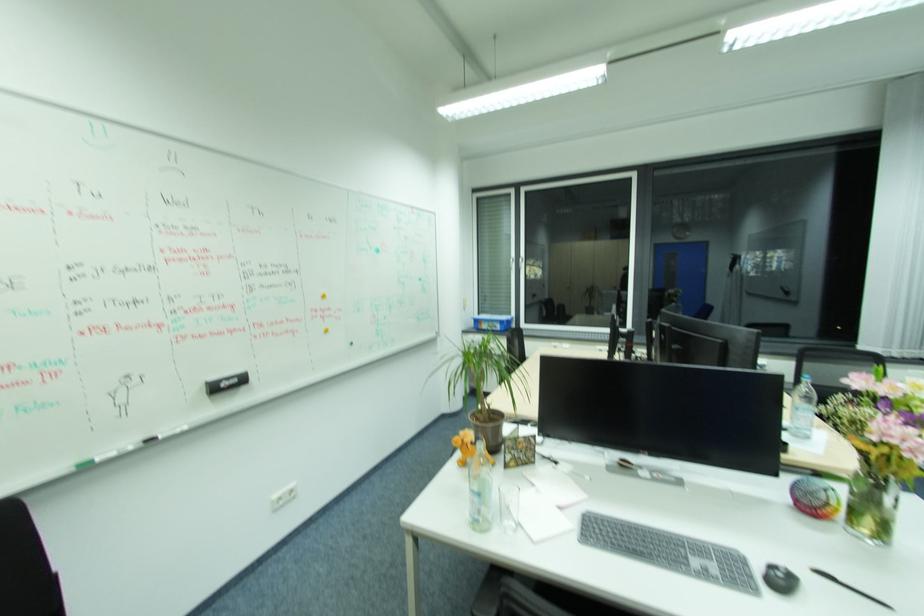
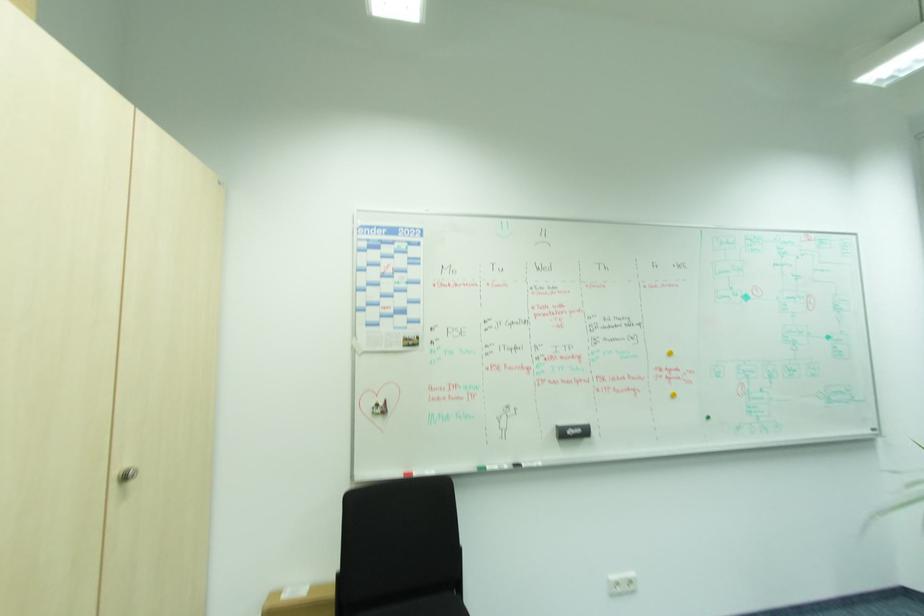
Question: The camera is either moving clockwise (left) or counter-clockwise (right) around the object. The first image is from the beginning of the video and the second image is from the end. Is the camera moving left or right when shooting the video?

Choices:
 (A) Left
 (B) Right

Answer: (B)